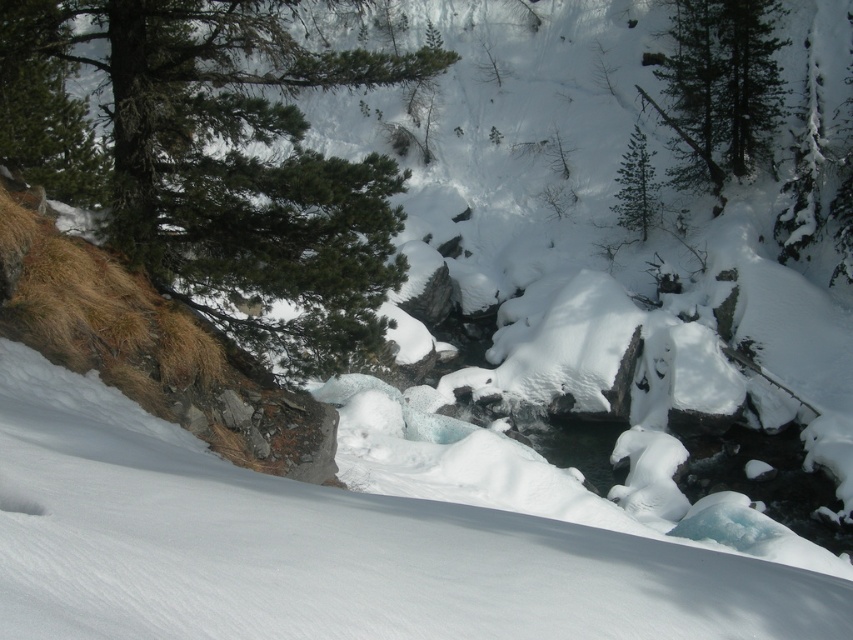
Question: Is green needle-like at upper left to the right of green matte tree at upper center from the viewer's perspective?

Choices:
 (A) no
 (B) yes

Answer: (A)

Question: Where is green needle-like at upper left located in relation to green matte tree at upper center in the image?

Choices:
 (A) right
 (B) left

Answer: (B)

Question: Is green needle-like at upper left to the right of green matte tree at upper center from the viewer's perspective?

Choices:
 (A) yes
 (B) no

Answer: (B)

Question: Among these objects, which one is farthest from the camera?

Choices:
 (A) green matte tree at upper center
 (B) green needle-like at upper left

Answer: (A)